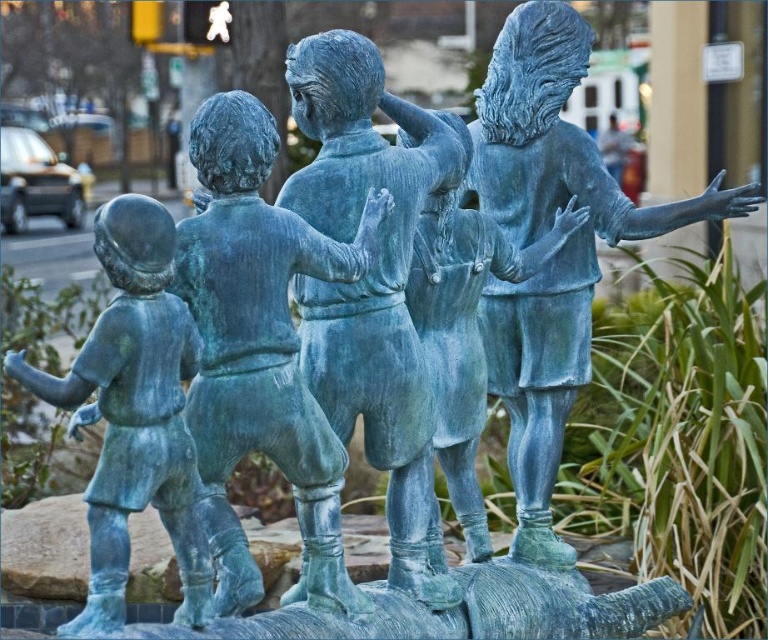
Based on the scene description, which object is taller between the green patina bronze statue at center and the green patina statue at left?

The green patina bronze statue at center is much taller than the green patina statue at left according to the description.

You are standing in front of the sculpture and want to touch both the green patina statue at center and the green patina statue at left. Which statue should you reach for first to touch the one closer to you?

You should reach for the green patina statue at center first because it is closer to you than the green patina statue at left.

You are an art conservator examining the green patina statue at center. Based on its coordinates, can you determine if it is placed centrally in the image?

The green patina statue at center is located at coordinates point (260, 348), which is close to the center of the image but slightly offset to the right and downward, so it is not perfectly centered.